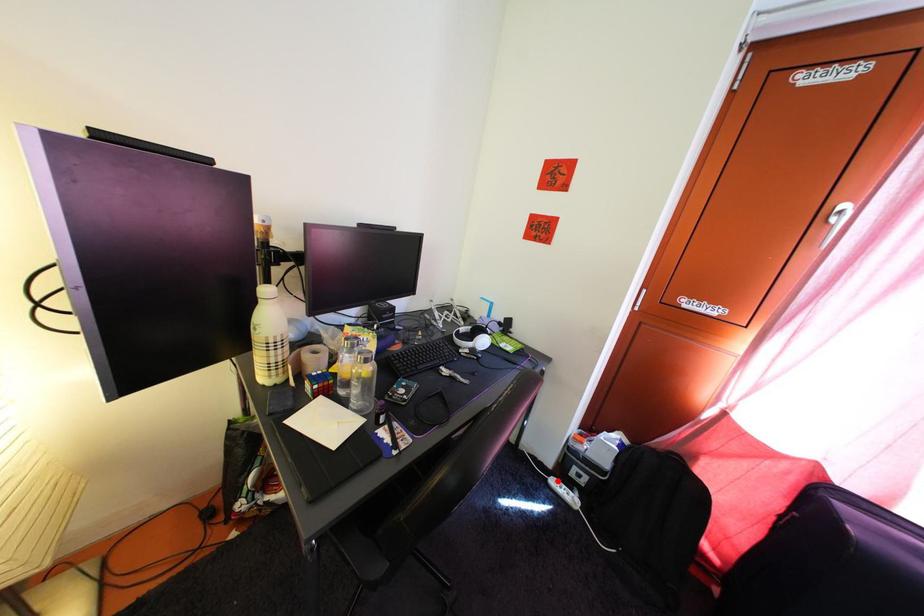
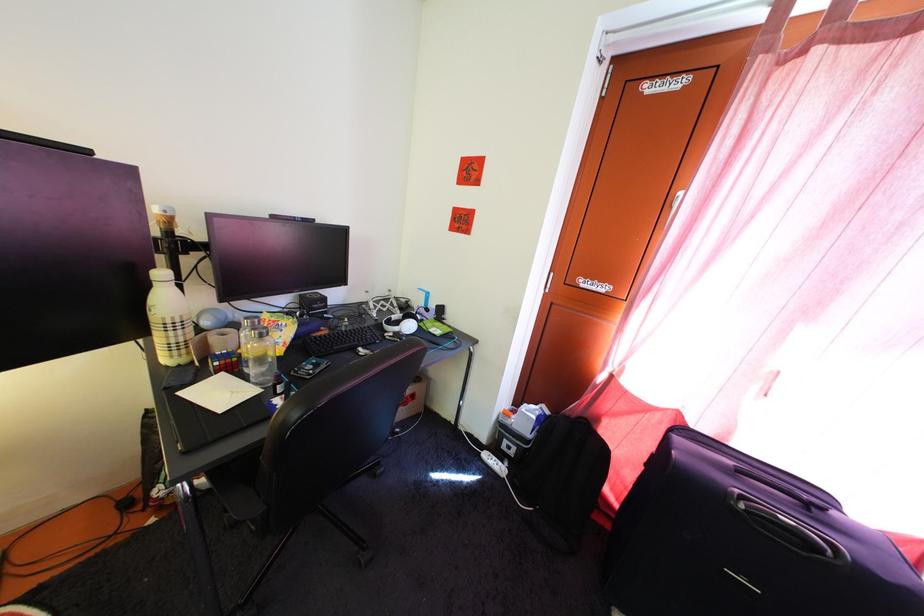
Question: A red point is marked in image1. In image2, is the corresponding 3D point closer to the camera or farther? Reply with the corresponding letter.

Choices:
 (A) The corresponding 3D point is closer.
 (B) The corresponding 3D point is farther.

Answer: (B)